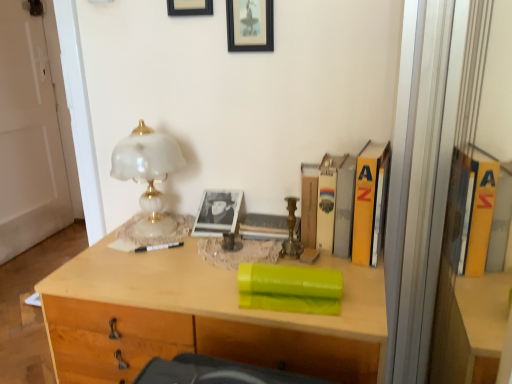
The image size is (512, 384). I want to click on vacant area on top of light wood desk at center (from a real-world perspective), so click(201, 256).